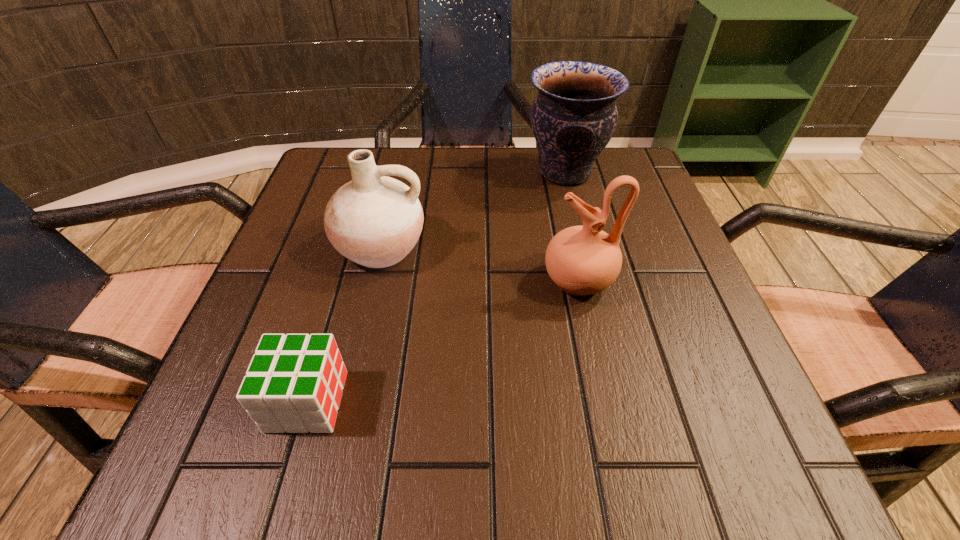
Image resolution: width=960 pixels, height=540 pixels. In order to click on the farthest object in this screenshot , I will do `click(574, 117)`.

Image resolution: width=960 pixels, height=540 pixels. What are the coordinates of `the leftmost pottery` in the screenshot? It's located at (374, 220).

This screenshot has width=960, height=540. I want to click on the nearest object, so click(x=294, y=382).

The image size is (960, 540). What are the coordinates of `cube` in the screenshot? It's located at (294, 382).

Image resolution: width=960 pixels, height=540 pixels. I want to click on free spot located 0.310m on the front handle of the farthest object, so click(x=388, y=172).

The height and width of the screenshot is (540, 960). What are the coordinates of `free spot located 0.300m on the front handle of the farthest object` in the screenshot? It's located at (393, 172).

Image resolution: width=960 pixels, height=540 pixels. I want to click on vacant region located 0.140m on the front handle of the farthest object, so click(x=463, y=172).

The height and width of the screenshot is (540, 960). In order to click on vacant region located 0.160m to pour from the handle of the leftmost pottery in this screenshot , I will do `click(354, 358)`.

The width and height of the screenshot is (960, 540). Identify the location of free region located on the red face of the cube. click(x=629, y=401).

Locate an element on the screen. This screenshot has height=540, width=960. object located in the far edge section of the desktop is located at coordinates (574, 117).